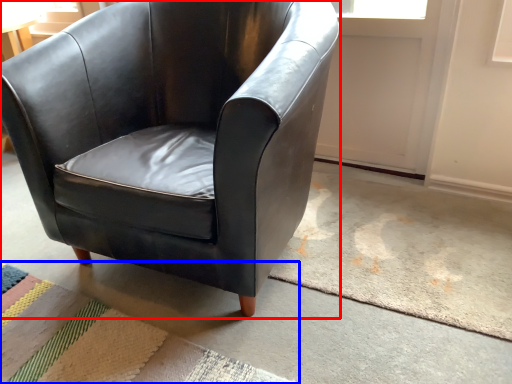
Question: Which object is closer to the camera taking this photo, chair (highlighted by a red box) or mat (highlighted by a blue box)?

Choices:
 (A) chair
 (B) mat

Answer: (A)